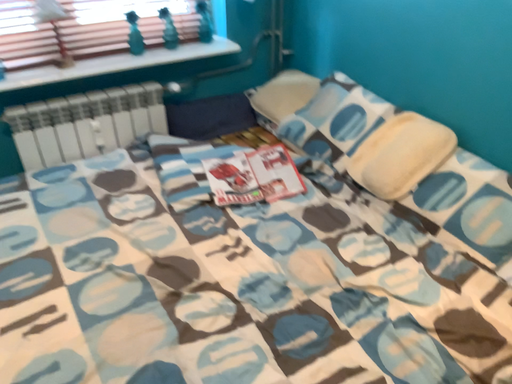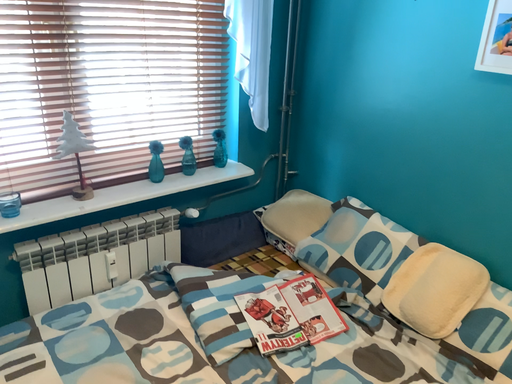
Question: Which way did the camera rotate in the video?

Choices:
 (A) rotated left
 (B) rotated right

Answer: (B)